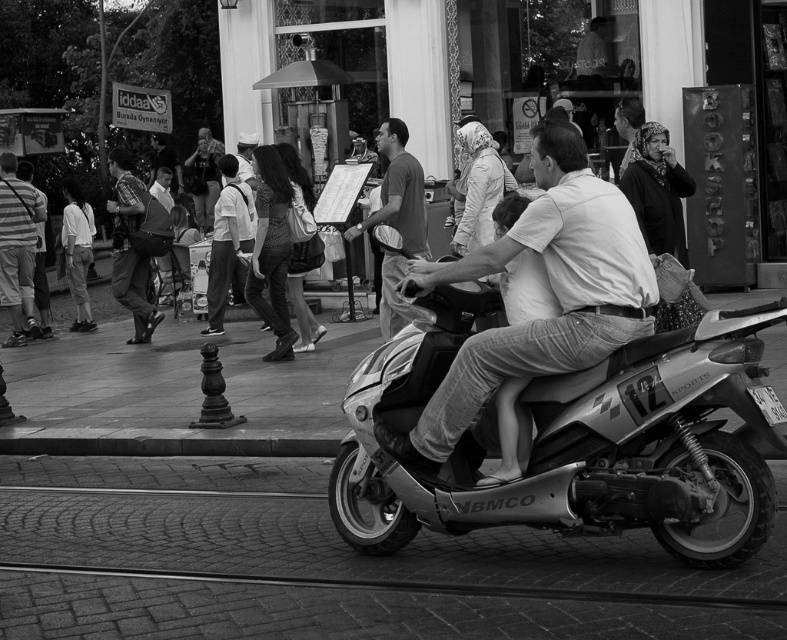
You are a fashion designer observing this urban street scene. You notice the matte black headscarf at upper right and the checkered shirt at left. Which clothing item is shorter in length?

The matte black headscarf at upper right is shorter than the checkered shirt at left.